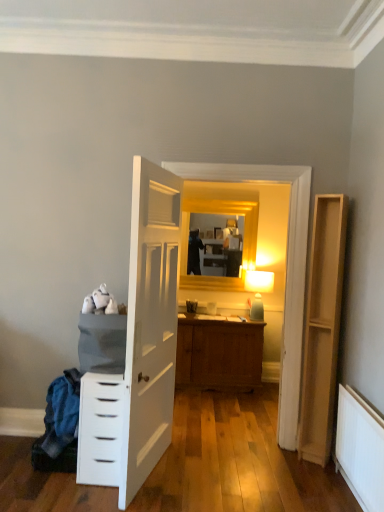
Question: Does white painted radiator at lower right touch light brown wood file cabinet at right?

Choices:
 (A) yes
 (B) no

Answer: (B)

Question: Can you confirm if white painted radiator at lower right is thinner than light brown wood file cabinet at right?

Choices:
 (A) no
 (B) yes

Answer: (B)

Question: Is white painted radiator at lower right shorter than light brown wood file cabinet at right?

Choices:
 (A) no
 (B) yes

Answer: (B)

Question: Would you say white painted radiator at lower right is a long distance from light brown wood file cabinet at right?

Choices:
 (A) yes
 (B) no

Answer: (B)

Question: From the image's perspective, is white painted radiator at lower right on top of light brown wood file cabinet at right?

Choices:
 (A) no
 (B) yes

Answer: (A)

Question: Is white painted radiator at lower right to the right of light brown wood file cabinet at right from the viewer's perspective?

Choices:
 (A) no
 (B) yes

Answer: (B)

Question: Can you confirm if white fabric laundry at lower left is smaller than light brown wood file cabinet at right?

Choices:
 (A) no
 (B) yes

Answer: (B)

Question: Considering the relative sizes of white fabric laundry at lower left and light brown wood file cabinet at right in the image provided, is white fabric laundry at lower left shorter than light brown wood file cabinet at right?

Choices:
 (A) no
 (B) yes

Answer: (B)

Question: Is white fabric laundry at lower left at the left side of light brown wood file cabinet at right?

Choices:
 (A) no
 (B) yes

Answer: (B)

Question: Is white fabric laundry at lower left not inside light brown wood file cabinet at right?

Choices:
 (A) yes
 (B) no

Answer: (A)

Question: Is the depth of white fabric laundry at lower left greater than that of light brown wood file cabinet at right?

Choices:
 (A) yes
 (B) no

Answer: (B)

Question: Does white fabric laundry at lower left come in front of light brown wood file cabinet at right?

Choices:
 (A) yes
 (B) no

Answer: (A)

Question: Can you confirm if gold wooden mirror at upper center is wider than light brown wood file cabinet at right?

Choices:
 (A) no
 (B) yes

Answer: (A)